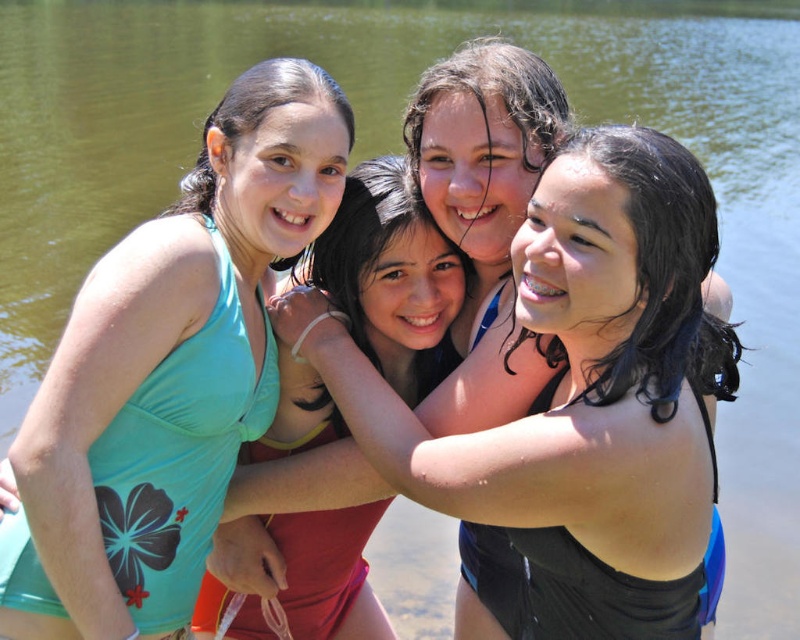
Is matte black swimsuit at center above black matte swimsuit at center?

No, matte black swimsuit at center is not above black matte swimsuit at center.

Looking at this image, between matte black swimsuit at center and black matte swimsuit at center, which one has less height?

black matte swimsuit at center

This screenshot has width=800, height=640. What are the coordinates of `matte black swimsuit at center` in the screenshot? It's located at (578, 396).

Image resolution: width=800 pixels, height=640 pixels. What are the coordinates of `matte black swimsuit at center` in the screenshot? It's located at (578, 396).

Find the location of a particular element. teal fabric bikini top at center is located at coordinates (392, 275).

Is point (294, 429) positioned behind point (446, 104)?

Yes.

Who is more distant from viewer, (x=358, y=211) or (x=476, y=92)?

Point (x=358, y=211)

Find the location of a particular element. This screenshot has width=800, height=640. teal fabric bikini top at center is located at coordinates (392, 275).

From the picture: Is matte black swimsuit at center further to camera compared to teal fabric bikini top at center?

No, matte black swimsuit at center is closer to the viewer.

Is point (606, 449) closer to camera compared to point (396, 243)?

Yes.

Find the location of `matte black swimsuit at center`. matte black swimsuit at center is located at coordinates (578, 396).